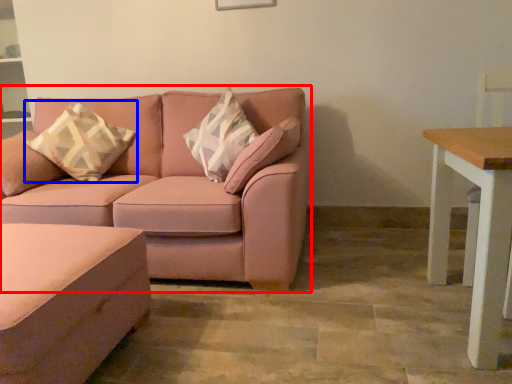
Question: Which object is closer to the camera taking this photo, studio couch (highlighted by a red box) or throw pillow (highlighted by a blue box)?

Choices:
 (A) studio couch
 (B) throw pillow

Answer: (A)